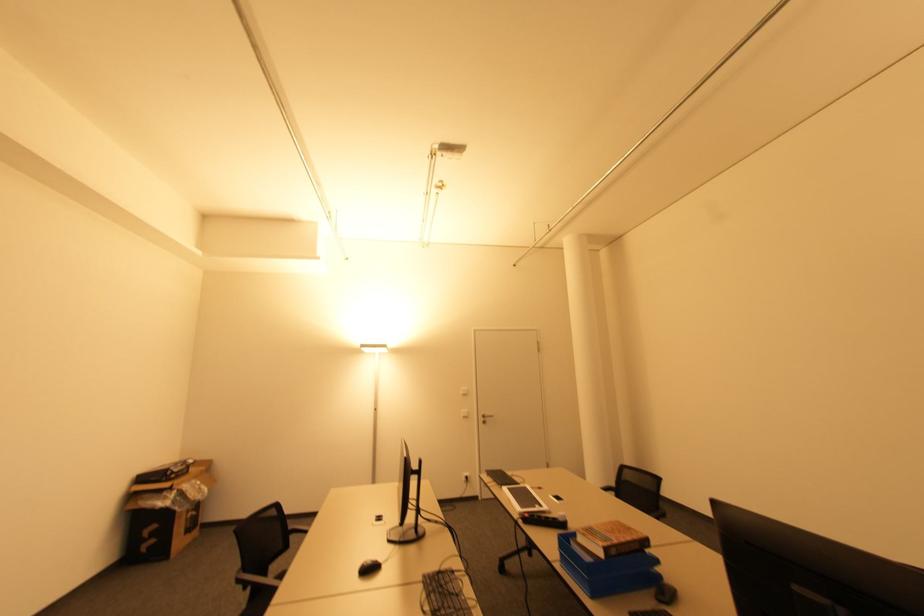
Describe the element at coordinates (611, 539) in the screenshot. I see `the brown cover book` at that location.